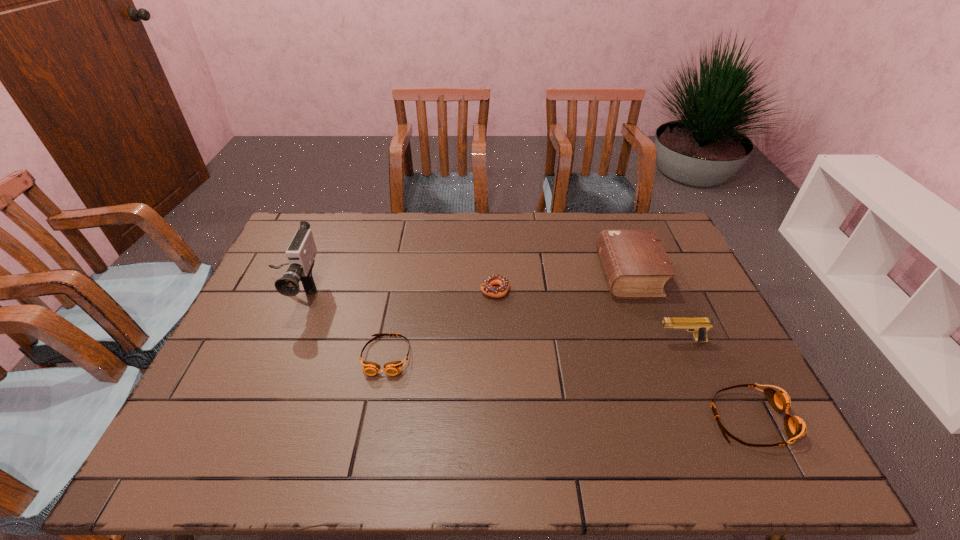
You are a GUI agent. You are given a task and a screenshot of the screen. Output one action in this format:
    pyautogui.click(x=<x>, y=<y>)
    Task: Click on the left goggles
    Image resolution: width=960 pixels, height=540 pixels.
    Given the screenshot: What is the action you would take?
    click(393, 368)

This screenshot has width=960, height=540. Find the location of `the fifth object from right to left`. the fifth object from right to left is located at coordinates (393, 368).

I want to click on the third shortest object, so click(x=795, y=427).

Locate an element on the screen. The image size is (960, 540). the nearest object is located at coordinates (795, 427).

This screenshot has height=540, width=960. I want to click on Bible, so click(636, 266).

You are a GUI agent. You are given a task and a screenshot of the screen. Output one action in this format:
    pyautogui.click(x=<x>, y=<y>)
    Task: Click on the camcorder
    The image size is (960, 540).
    Given the screenshot: What is the action you would take?
    pyautogui.click(x=302, y=250)

Locate an element on the screen. the leftmost object is located at coordinates (302, 250).

Identify the location of pistol. (699, 326).

What are the coordinates of `the fourth object from right to left` in the screenshot? It's located at click(487, 288).

I want to click on free spot located with the lenses facing forward on the farther goggles, so click(x=373, y=420).